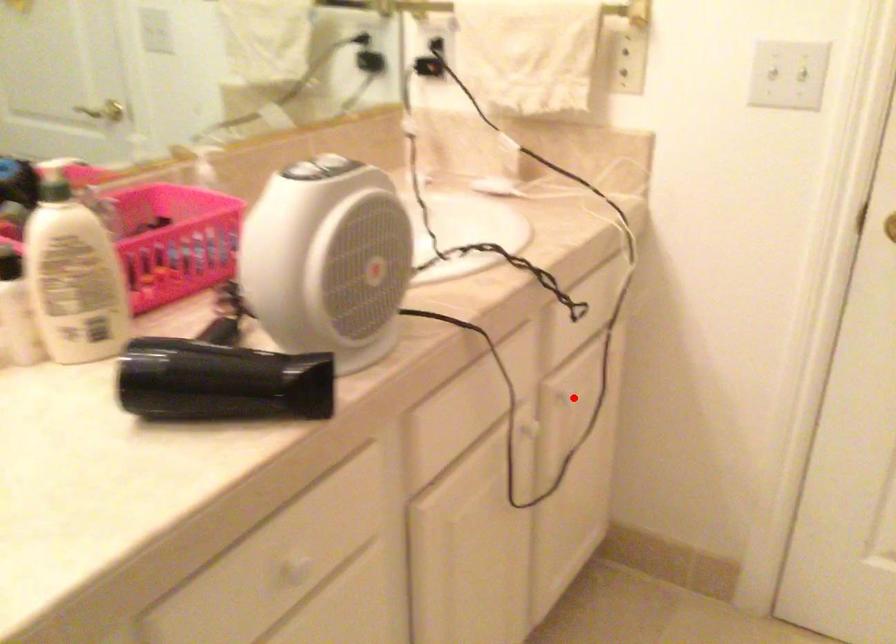
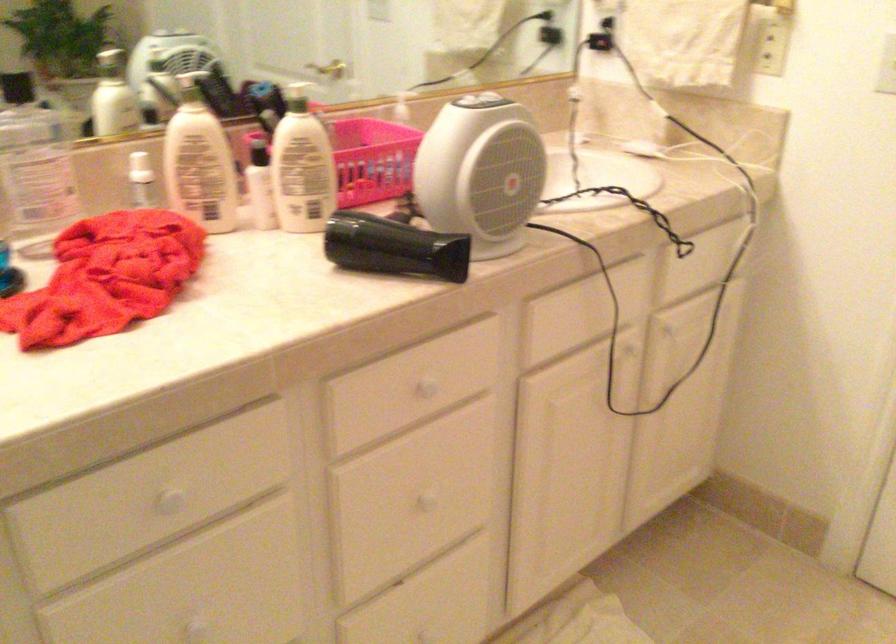
Where in the second image is the point corresponding to the highlighted location from the first image?

(675, 335)